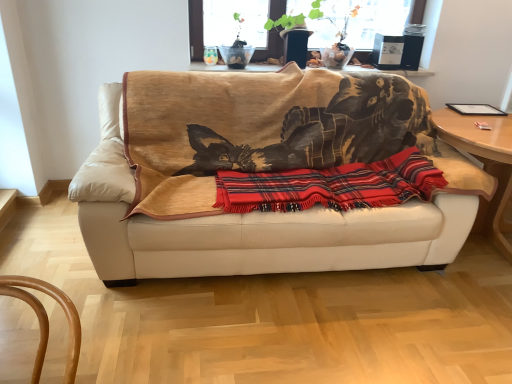
Where is `beige leather couch at center`? This screenshot has width=512, height=384. beige leather couch at center is located at coordinates (259, 169).

This screenshot has height=384, width=512. What do you see at coordinates (394, 71) in the screenshot? I see `wooden table at upper center, placed as the second table when sorted from bottom to top` at bounding box center [394, 71].

Where is `wooden table at upper center, placed as the second table when sorted from bottom to top`? wooden table at upper center, placed as the second table when sorted from bottom to top is located at coordinates (394, 71).

Find the location of a particular element. The width and height of the screenshot is (512, 384). wooden round table at right, which appears as the second table when viewed from the top is located at coordinates (484, 163).

Which of these two, red plaid blanket at center or beige leather couch at center, is smaller?

Smaller between the two is red plaid blanket at center.

Considering the positions of objects red plaid blanket at center and beige leather couch at center in the image provided, who is in front, red plaid blanket at center or beige leather couch at center?

beige leather couch at center is more forward.

What's the angular difference between red plaid blanket at center and beige leather couch at center's facing directions?

The angle between the facing direction of red plaid blanket at center and the facing direction of beige leather couch at center is 0.492 degrees.

Is red plaid blanket at center with beige leather couch at center?

red plaid blanket at center is not next to beige leather couch at center, and they're not touching.

From the image's perspective, is wooden table at upper center, which is the first table from top to bottom, located beneath red plaid blanket at center?

No.

Can you confirm if wooden table at upper center, which is the first table from top to bottom, is bigger than red plaid blanket at center?

No.

Considering the relative positions of wooden table at upper center, the second table when ordered from right to left, and red plaid blanket at center in the image provided, is wooden table at upper center, the second table when ordered from right to left, in front of red plaid blanket at center?

No, it is behind red plaid blanket at center.

In the scene shown: Is red plaid blanket at center facing towards wooden round table at right, the 1th table when ordered from right to left?

No, red plaid blanket at center does not turn towards wooden round table at right, the 1th table when ordered from right to left.

Is there a large distance between red plaid blanket at center and wooden round table at right, the 1th table when ordered from right to left?

No.

Is red plaid blanket at center to the right of wooden round table at right, arranged as the first table when ordered from the bottom, from the viewer's perspective?

In fact, red plaid blanket at center is to the left of wooden round table at right, arranged as the first table when ordered from the bottom.

Considering the relative positions of red plaid blanket at center and wooden round table at right, which appears as the second table when viewed from the top, in the image provided, is red plaid blanket at center in front of wooden round table at right, which appears as the second table when viewed from the top,?

Yes, red plaid blanket at center is closer to the camera.

Considering the relative positions of wooden table at upper center, placed as the second table when sorted from bottom to top, and wooden round table at right, the 1th table when ordered from right to left, in the image provided, is wooden table at upper center, placed as the second table when sorted from bottom to top, to the left of wooden round table at right, the 1th table when ordered from right to left, from the viewer's perspective?

Yes.

Is wooden round table at right, which is counted as the 2th table, starting from the left, at the back of wooden table at upper center, the second table when ordered from right to left?

No, wooden table at upper center, the second table when ordered from right to left, is not facing the opposite direction of wooden round table at right, which is counted as the 2th table, starting from the left.

Between wooden table at upper center, the second table when ordered from right to left, and wooden round table at right, arranged as the first table when ordered from the bottom, which one has larger width?

wooden round table at right, arranged as the first table when ordered from the bottom, is wider.

Considering the relative positions of wooden table at upper center, placed as the second table when sorted from bottom to top, and wooden round table at right, arranged as the first table when ordered from the bottom, in the image provided, is wooden table at upper center, placed as the second table when sorted from bottom to top, behind wooden round table at right, arranged as the first table when ordered from the bottom,?

Yes, it is.

Which object is wider, wooden round table at right, which is counted as the 2th table, starting from the left, or wooden table at upper center, the second table when ordered from right to left?

wooden round table at right, which is counted as the 2th table, starting from the left.

Considering the positions of objects wooden round table at right, the 1th table when ordered from right to left, and wooden table at upper center, which is counted as the first table, starting from the left, in the image provided, who is in front, wooden round table at right, the 1th table when ordered from right to left, or wooden table at upper center, which is counted as the first table, starting from the left,?

wooden round table at right, the 1th table when ordered from right to left.

From a real-world perspective, does wooden round table at right, arranged as the first table when ordered from the bottom, sit lower than wooden table at upper center, which is the first table from top to bottom?

Yes, from a real-world perspective, wooden round table at right, arranged as the first table when ordered from the bottom, is beneath wooden table at upper center, which is the first table from top to bottom.

Does beige leather couch at center have a smaller size compared to red plaid blanket at center?

No, beige leather couch at center is not smaller than red plaid blanket at center.

Is the depth of beige leather couch at center greater than that of red plaid blanket at center?

No, beige leather couch at center is in front of red plaid blanket at center.

Is beige leather couch at center outside of red plaid blanket at center?

Yes, beige leather couch at center is located beyond the bounds of red plaid blanket at center.

Considering the positions of points (466, 137) and (433, 200), is point (466, 137) closer to camera compared to point (433, 200)?

That is False.

Would you say beige leather couch at center is part of wooden round table at right, arranged as the first table when ordered from the bottom,'s contents?

Actually, beige leather couch at center is outside wooden round table at right, arranged as the first table when ordered from the bottom.

Between wooden round table at right, arranged as the first table when ordered from the bottom, and beige leather couch at center, which one has larger width?

wooden round table at right, arranged as the first table when ordered from the bottom, is wider.

Is wooden round table at right, which appears as the second table when viewed from the top, shorter than beige leather couch at center?

Indeed, wooden round table at right, which appears as the second table when viewed from the top, has a lesser height compared to beige leather couch at center.

Find the location of a particular element. This screenshot has width=512, height=384. plaid behind the beige leather couch at center is located at coordinates (331, 185).

Locate an element on the screen. plaid on the left of wooden table at upper center, which is the first table from top to bottom is located at coordinates tap(331, 185).

From the image, which object appears to be nearer to wooden table at upper center, placed as the second table when sorted from bottom to top, wooden round table at right, the 1th table when ordered from right to left, or red plaid blanket at center?

Based on the image, red plaid blanket at center appears to be nearer to wooden table at upper center, placed as the second table when sorted from bottom to top.

From the image, which object appears to be nearer to red plaid blanket at center, wooden round table at right, which is counted as the 2th table, starting from the left, or beige leather couch at center?

beige leather couch at center.

When comparing their distances from red plaid blanket at center, does beige leather couch at center or wooden round table at right, which appears as the second table when viewed from the top, seem further?

Based on the image, wooden round table at right, which appears as the second table when viewed from the top, appears to be further to red plaid blanket at center.

Which object lies nearer to the anchor point wooden table at upper center, placed as the second table when sorted from bottom to top, red plaid blanket at center or wooden round table at right, which appears as the second table when viewed from the top?

red plaid blanket at center is positioned closer to the anchor wooden table at upper center, placed as the second table when sorted from bottom to top.

Consider the image. When comparing their distances from red plaid blanket at center, does wooden table at upper center, which is counted as the first table, starting from the left, or wooden round table at right, which is counted as the 2th table, starting from the left, seem further?

wooden table at upper center, which is counted as the first table, starting from the left, lies further to red plaid blanket at center than the other object.

Considering their positions, is wooden table at upper center, which is the first table from top to bottom, positioned further to red plaid blanket at center than beige leather couch at center?

wooden table at upper center, which is the first table from top to bottom.

Which object lies nearer to the anchor point red plaid blanket at center, wooden round table at right, which appears as the second table when viewed from the top, or wooden table at upper center, which is the first table from top to bottom?

The object closer to red plaid blanket at center is wooden round table at right, which appears as the second table when viewed from the top.

Which object lies further to the anchor point beige leather couch at center, wooden table at upper center, which is counted as the first table, starting from the left, or red plaid blanket at center?

wooden table at upper center, which is counted as the first table, starting from the left.

I want to click on table between beige leather couch at center and wooden round table at right, the 1th table when ordered from right to left, so click(x=394, y=71).

In order to click on plaid between beige leather couch at center and wooden round table at right, which appears as the second table when viewed from the top, in the horizontal direction in this screenshot , I will do `click(331, 185)`.

Find the location of a particular element. The height and width of the screenshot is (384, 512). plaid between beige leather couch at center and wooden table at upper center, placed as the second table when sorted from bottom to top, in the front-back direction is located at coordinates (331, 185).

Where is `table between red plaid blanket at center and wooden round table at right, which is counted as the 2th table, starting from the left, from left to right`? The image size is (512, 384). table between red plaid blanket at center and wooden round table at right, which is counted as the 2th table, starting from the left, from left to right is located at coordinates (394, 71).